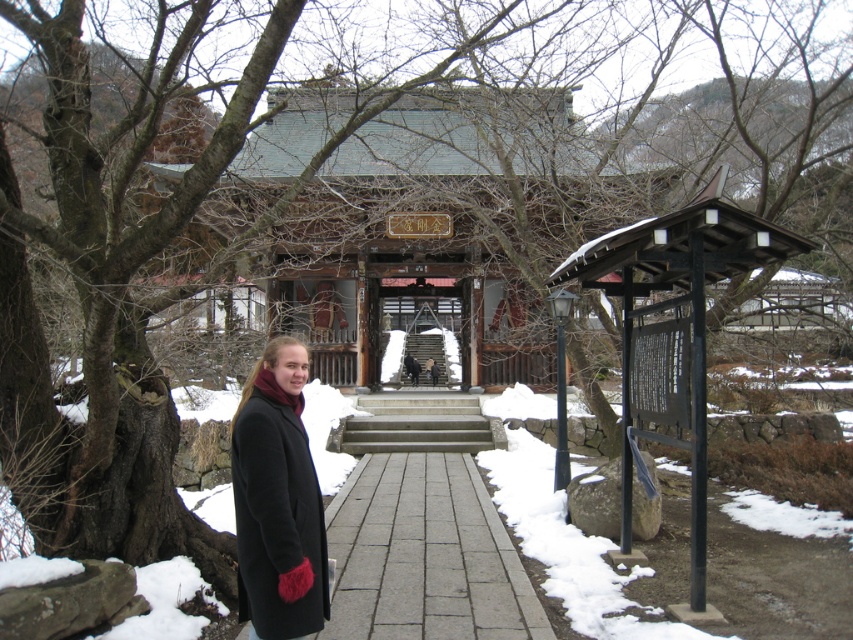
Question: Can you confirm if gray stone path at center is positioned to the right of black wool coat at center?

Choices:
 (A) no
 (B) yes

Answer: (B)

Question: Can you confirm if gray stone path at center is positioned to the left of black wool coat at center?

Choices:
 (A) yes
 (B) no

Answer: (B)

Question: Is gray stone path at center bigger than black wool coat at center?

Choices:
 (A) yes
 (B) no

Answer: (B)

Question: Which point is farther to the camera?

Choices:
 (A) black wool coat at center
 (B) gray stone path at center

Answer: (B)

Question: Among these objects, which one is nearest to the camera?

Choices:
 (A) black wool coat at center
 (B) gray stone path at center

Answer: (A)